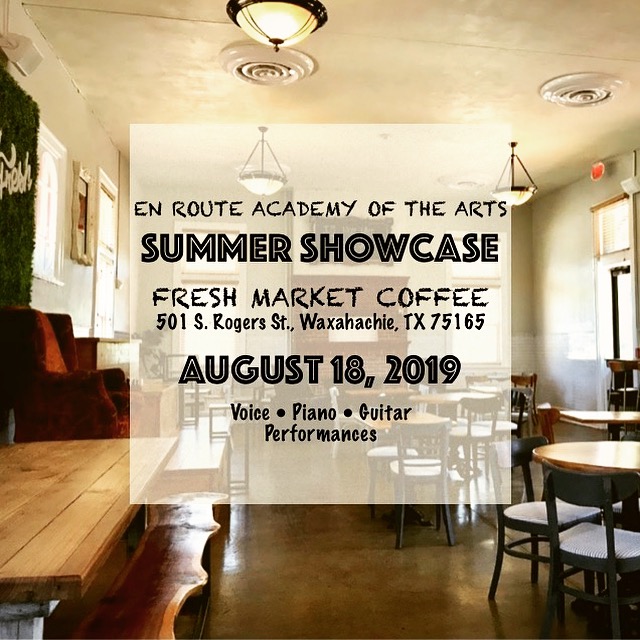
This screenshot has width=640, height=640. I want to click on wood bench, so click(157, 576).